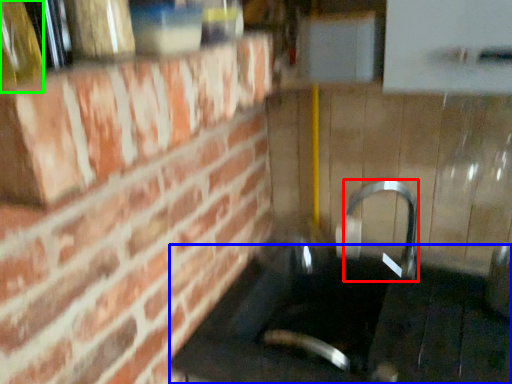
Question: Estimate the real-world distances between objects in this image. Which object is closer to faucet (highlighted by a red box), counter top (highlighted by a blue box) or bottle (highlighted by a green box)?

Choices:
 (A) counter top
 (B) bottle

Answer: (A)